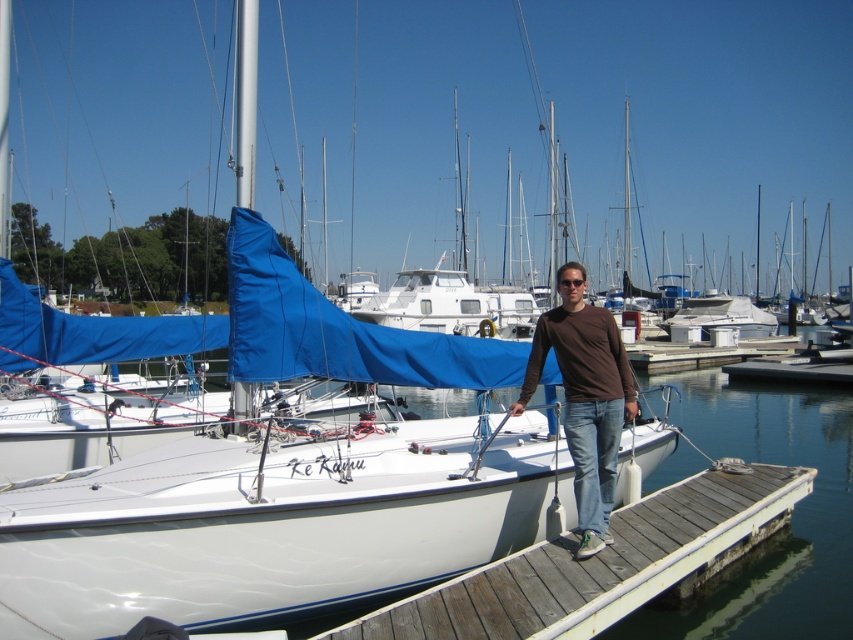
Question: Estimate the real-world distances between objects in this image. Which object is farther from the brown cotton shirt at center?

Choices:
 (A) wooden dock at center
 (B) wooden at center

Answer: (B)

Question: Is wooden dock at center thinner than brown cotton shirt at center?

Choices:
 (A) yes
 (B) no

Answer: (B)

Question: Which point is closer to the camera?

Choices:
 (A) wooden dock at center
 (B) brown cotton shirt at center
 (C) wooden at center

Answer: (A)

Question: Can you confirm if brown cotton shirt at center is smaller than wooden at center?

Choices:
 (A) no
 (B) yes

Answer: (B)

Question: Can you confirm if wooden dock at center is thinner than wooden at center?

Choices:
 (A) yes
 (B) no

Answer: (A)

Question: Which of the following is the farthest from the observer?

Choices:
 (A) wooden at center
 (B) wooden dock at center

Answer: (A)